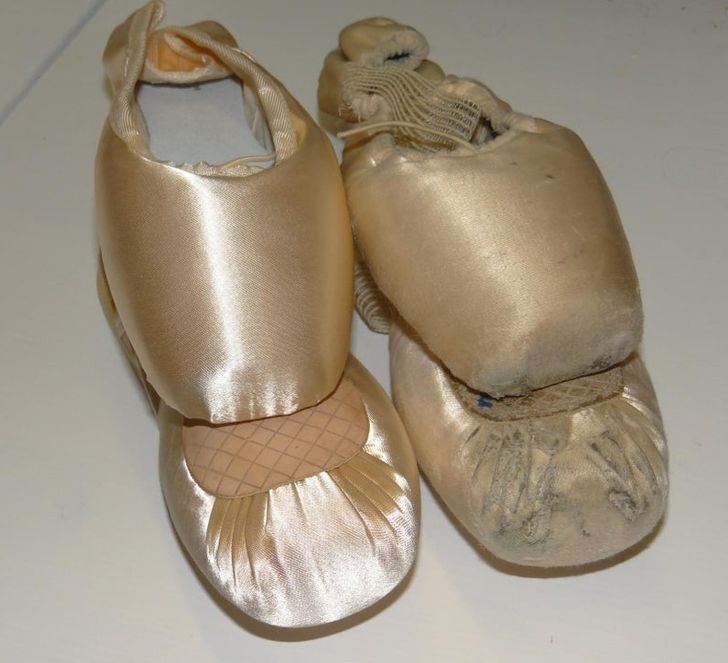
You are a GUI agent. You are given a task and a screenshot of the screen. Output one action in this format:
    pyautogui.click(x=<x>, y=<y>)
    Task: Click on the tile
    This screenshot has height=663, width=728.
    Given the screenshot: What is the action you would take?
    pyautogui.click(x=62, y=402)